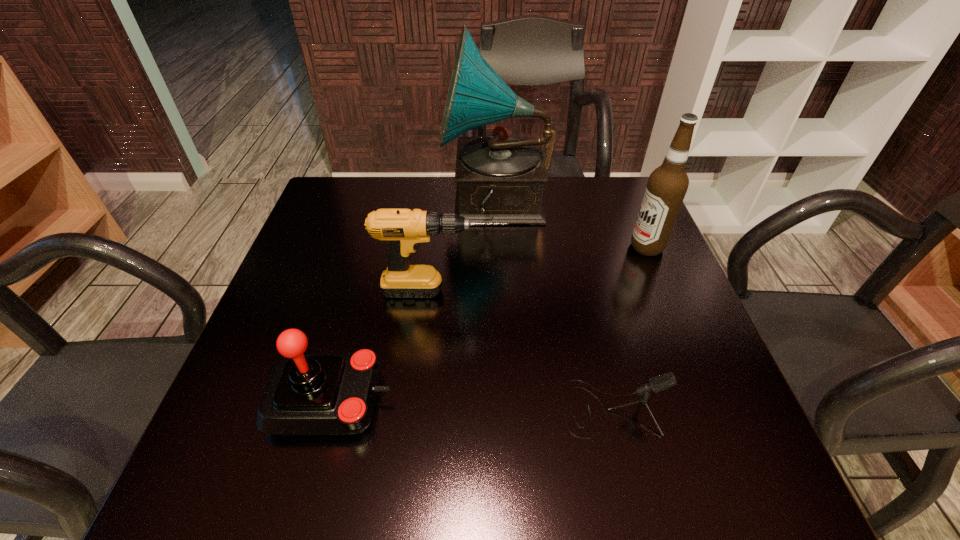
Locate an element on the screen. object that can be found as the third closest to the shortest object is located at coordinates click(667, 185).

Find the location of a particular element. object that is the third closest to the shortest object is located at coordinates (667, 185).